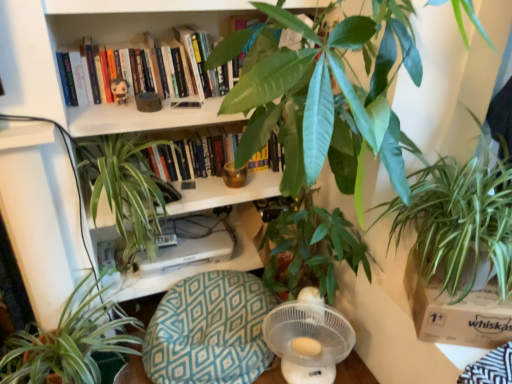
Question: Does plush toy at upper center have a larger size compared to green leafy plant at lower left, arranged as the first houseplant when viewed from the left?

Choices:
 (A) no
 (B) yes

Answer: (A)

Question: Does plush toy at upper center have a greater height compared to green leafy plant at lower left, acting as the fourth houseplant starting from the right?

Choices:
 (A) yes
 (B) no

Answer: (B)

Question: Is plush toy at upper center behind green leafy plant at lower left, acting as the fourth houseplant starting from the right?

Choices:
 (A) yes
 (B) no

Answer: (A)

Question: Does plush toy at upper center appear on the left side of green leafy plant at lower left, acting as the fourth houseplant starting from the right?

Choices:
 (A) yes
 (B) no

Answer: (B)

Question: Is plush toy at upper center positioned in front of green leafy plant at lower left, acting as the fourth houseplant starting from the right?

Choices:
 (A) no
 (B) yes

Answer: (A)

Question: Is green leafy plant at center, which is counted as the third houseplant, starting from the left, inside or outside of plush toy at upper center?

Choices:
 (A) outside
 (B) inside

Answer: (A)

Question: Is green leafy plant at center, which is counted as the third houseplant, starting from the left, bigger or smaller than plush toy at upper center?

Choices:
 (A) big
 (B) small

Answer: (A)

Question: From their relative heights in the image, would you say green leafy plant at center, which is counted as the third houseplant, starting from the left, is taller or shorter than plush toy at upper center?

Choices:
 (A) short
 (B) tall

Answer: (B)

Question: From the image's perspective, is green leafy plant at center, arranged as the 2th houseplant when viewed from the right, positioned above or below plush toy at upper center?

Choices:
 (A) below
 (B) above

Answer: (A)

Question: Based on their sizes in the image, would you say white cardboard box at lower right is bigger or smaller than white plastic fan at lower center?

Choices:
 (A) small
 (B) big

Answer: (A)

Question: Is point (490, 329) positioned closer to the camera than point (307, 359)?

Choices:
 (A) closer
 (B) farther

Answer: (A)

Question: In the image, is white cardboard box at lower right on the left side or the right side of white plastic fan at lower center?

Choices:
 (A) right
 (B) left

Answer: (A)

Question: From the image's perspective, is white cardboard box at lower right located above or below white plastic fan at lower center?

Choices:
 (A) above
 (B) below

Answer: (A)

Question: Considering the positions of point (128, 190) and point (119, 102), is point (128, 190) closer or farther from the camera than point (119, 102)?

Choices:
 (A) closer
 (B) farther

Answer: (A)

Question: From a real-world perspective, relative to plush toy at upper center, is green leafy plant at center, the 3th houseplant in the right-to-left sequence, vertically above or below?

Choices:
 (A) above
 (B) below

Answer: (B)